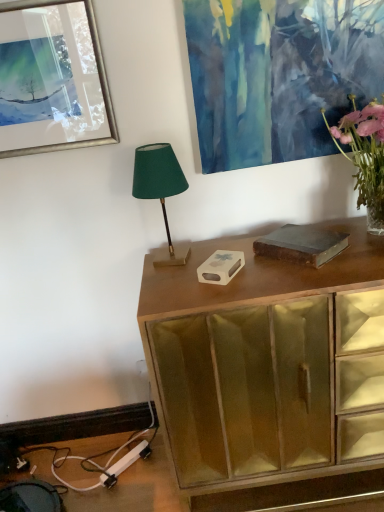
Question: Could you tell me if green fabric lampshade at center is facing wooden cabinet at center?

Choices:
 (A) no
 (B) yes

Answer: (A)

Question: From the image's perspective, does green fabric lampshade at center appear lower than wooden cabinet at center?

Choices:
 (A) no
 (B) yes

Answer: (A)

Question: Does green fabric lampshade at center have a lesser height compared to wooden cabinet at center?

Choices:
 (A) no
 (B) yes

Answer: (B)

Question: Is green fabric lampshade at center placed right next to wooden cabinet at center?

Choices:
 (A) no
 (B) yes

Answer: (A)

Question: Is green fabric lampshade at center positioned with its back to wooden cabinet at center?

Choices:
 (A) no
 (B) yes

Answer: (A)

Question: Considering the relative sizes of green fabric lampshade at center and wooden cabinet at center in the image provided, is green fabric lampshade at center smaller than wooden cabinet at center?

Choices:
 (A) yes
 (B) no

Answer: (A)

Question: From a real-world perspective, is green fabric lampshade at center located higher than metallic silver picture frame at upper left?

Choices:
 (A) yes
 (B) no

Answer: (B)

Question: Is green fabric lampshade at center thinner than metallic silver picture frame at upper left?

Choices:
 (A) no
 (B) yes

Answer: (A)

Question: From the image's perspective, is green fabric lampshade at center beneath metallic silver picture frame at upper left?

Choices:
 (A) no
 (B) yes

Answer: (B)

Question: Considering the relative sizes of green fabric lampshade at center and metallic silver picture frame at upper left in the image provided, is green fabric lampshade at center shorter than metallic silver picture frame at upper left?

Choices:
 (A) no
 (B) yes

Answer: (B)

Question: Considering the relative positions of green fabric lampshade at center and metallic silver picture frame at upper left in the image provided, is green fabric lampshade at center to the left of metallic silver picture frame at upper left from the viewer's perspective?

Choices:
 (A) no
 (B) yes

Answer: (A)

Question: Can you confirm if green fabric lampshade at center is taller than metallic silver picture frame at upper left?

Choices:
 (A) yes
 (B) no

Answer: (B)

Question: From the image's perspective, is wooden cabinet at center beneath pink glass vase at upper right?

Choices:
 (A) no
 (B) yes

Answer: (B)